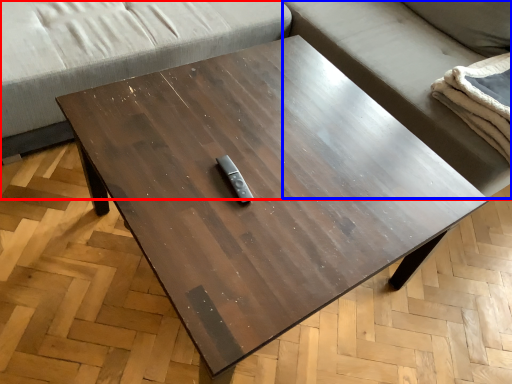
Question: Which object appears farthest to the camera in this image, studio couch (highlighted by a red box) or couch (highlighted by a blue box)?

Choices:
 (A) studio couch
 (B) couch

Answer: (B)